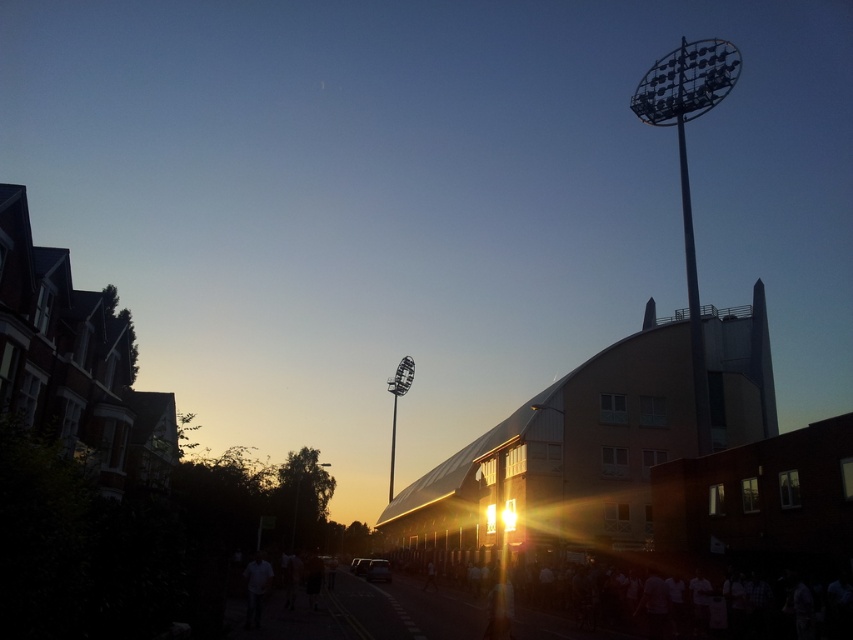
Question: Is white matte crowd at lower right closer to camera compared to yellow painted asphalt at center?

Choices:
 (A) yes
 (B) no

Answer: (A)

Question: Which point is farther to the camera?

Choices:
 (A) yellow painted asphalt at center
 (B) white matte crowd at lower right

Answer: (A)

Question: Which point is farther to the camera?

Choices:
 (A) white matte crowd at lower right
 (B) yellow painted asphalt at center

Answer: (B)

Question: Can you confirm if white matte crowd at lower right is positioned to the right of yellow painted asphalt at center?

Choices:
 (A) yes
 (B) no

Answer: (A)

Question: Does white matte crowd at lower right have a greater width compared to yellow painted asphalt at center?

Choices:
 (A) no
 (B) yes

Answer: (B)